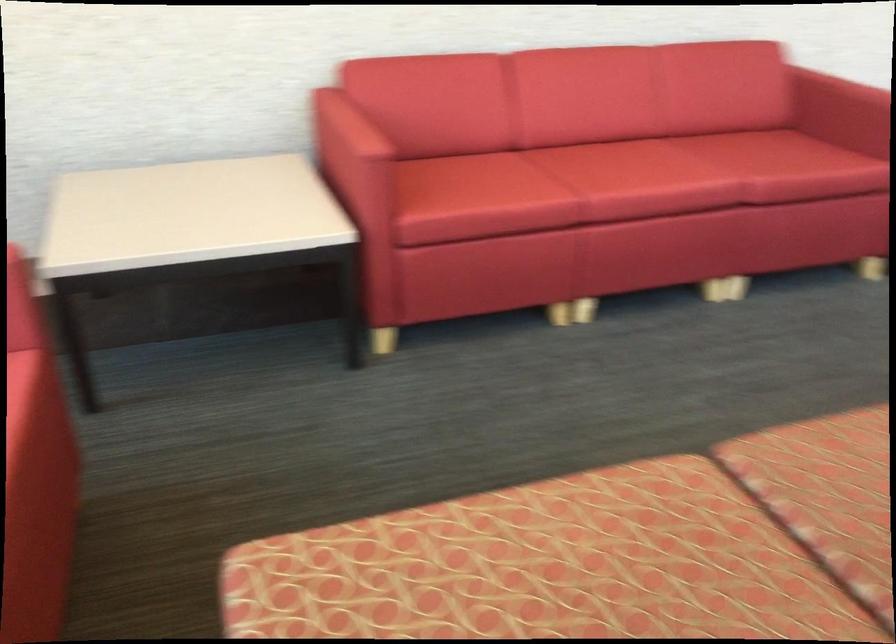
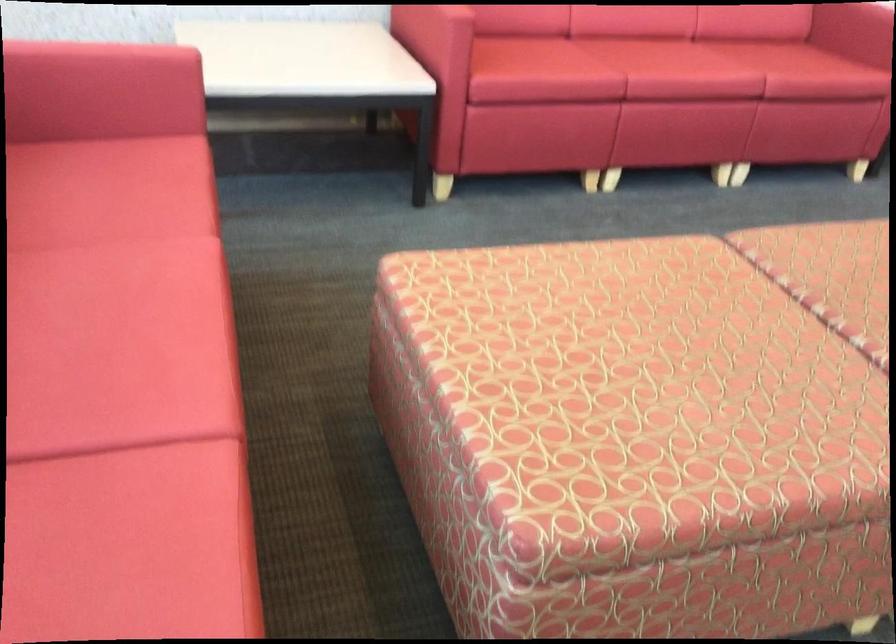
Which direction would the cameraman need to move to produce the second image?

The cameraman moved toward left, backward.